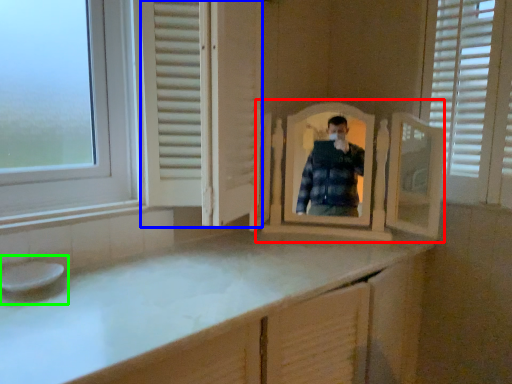
Question: Considering the real-world distances, which object is closest to mirror (highlighted by a red box)? screen door (highlighted by a blue box) or sink (highlighted by a green box).

Choices:
 (A) screen door
 (B) sink

Answer: (A)